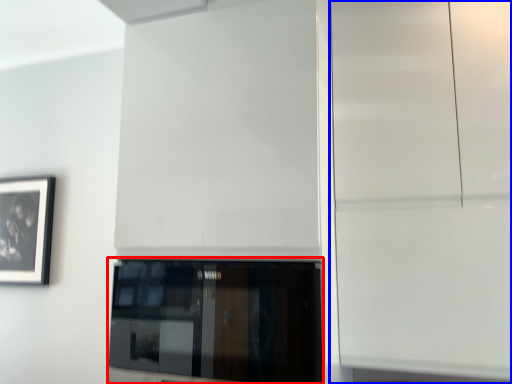
Question: Which object is closer to the camera taking this photo, window (highlighted by a red box) or glass door (highlighted by a blue box)?

Choices:
 (A) window
 (B) glass door

Answer: (A)